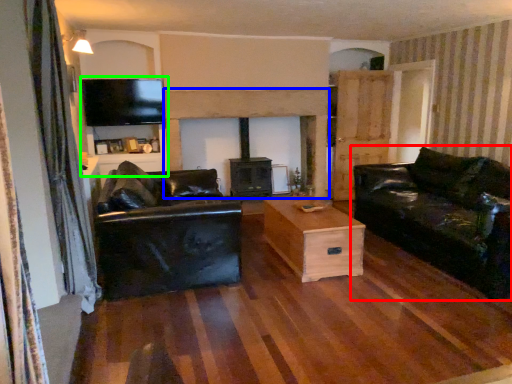
Question: Based on their relative distances, which object is farther from studio couch (highlighted by a red box)? Choose from fireplace (highlighted by a blue box) and entertainment center (highlighted by a green box).

Choices:
 (A) fireplace
 (B) entertainment center

Answer: (B)